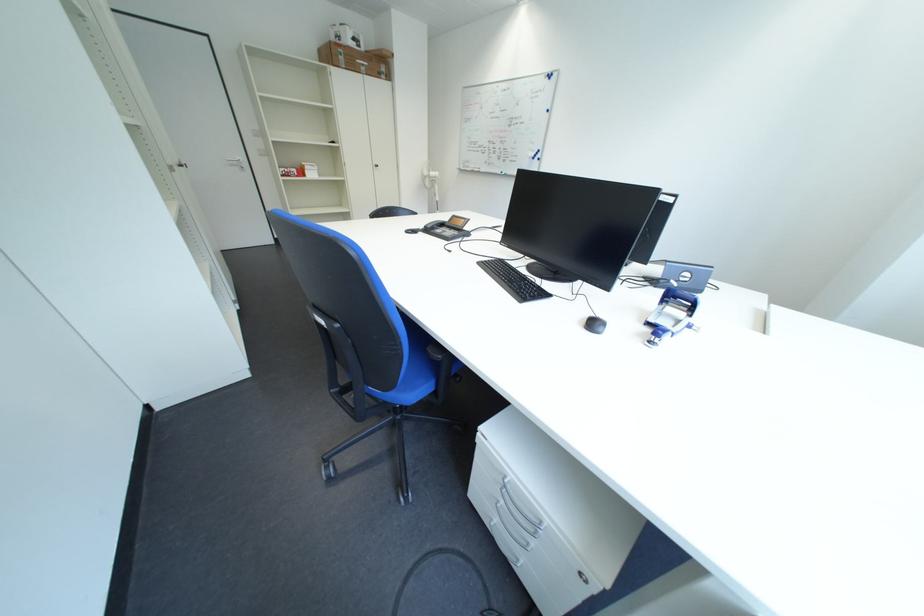
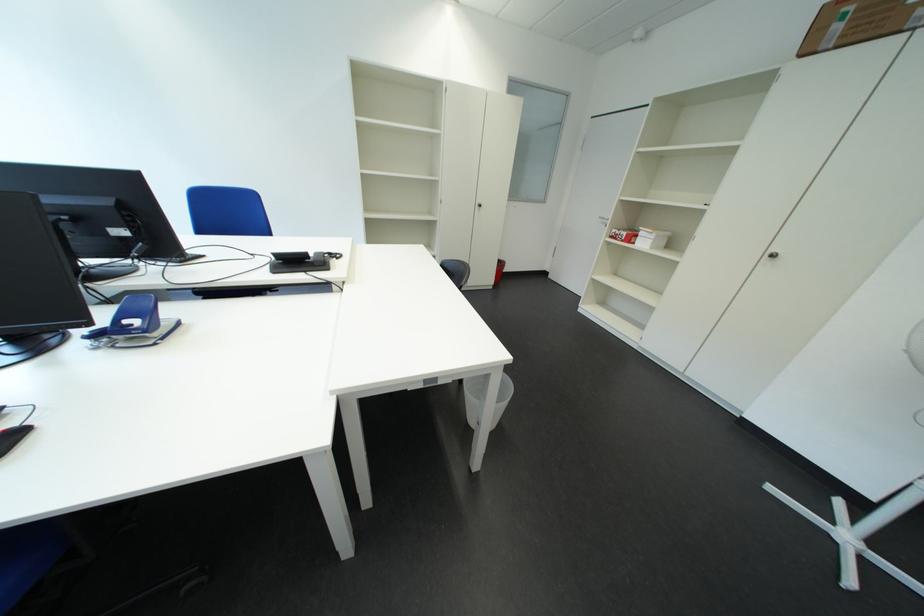
The point at (324, 177) is marked in the first image. Where is the corresponding point in the second image?

(657, 246)